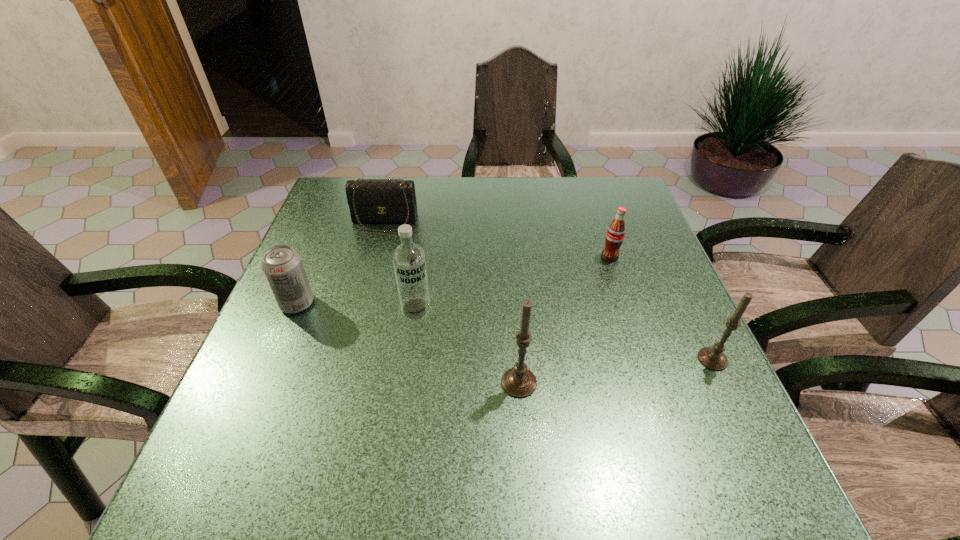
Locate an element on the screen. This screenshot has height=540, width=960. the leftmost object is located at coordinates (282, 266).

Identify the location of vacant space located 0.340m on the right of the left candle. (714, 383).

Where is `free spot located on the left of the shorter candle`? free spot located on the left of the shorter candle is located at coordinates (504, 359).

Find the location of a particular element. This screenshot has height=540, width=960. free space located 0.200m on the front flap of the farthest object is located at coordinates (368, 284).

Locate an element on the screen. vacant area situated on the back of the second object from right to left is located at coordinates (594, 211).

Where is `vacant region located on the front label of the third object from left to right`? This screenshot has width=960, height=540. vacant region located on the front label of the third object from left to right is located at coordinates (402, 407).

This screenshot has width=960, height=540. Identify the location of free space located 0.330m on the back of the left soda can. (336, 211).

At what (x,y) coordinates should I click in order to perform the action: click on object at the far edge. Please return your answer as a coordinate pair (x, y). This screenshot has height=540, width=960. Looking at the image, I should click on (370, 200).

The width and height of the screenshot is (960, 540). In order to click on object located at the near edge in this screenshot , I will do `click(519, 382)`.

The height and width of the screenshot is (540, 960). In order to click on clutch bag located in the left edge section of the desktop in this screenshot , I will do `click(370, 200)`.